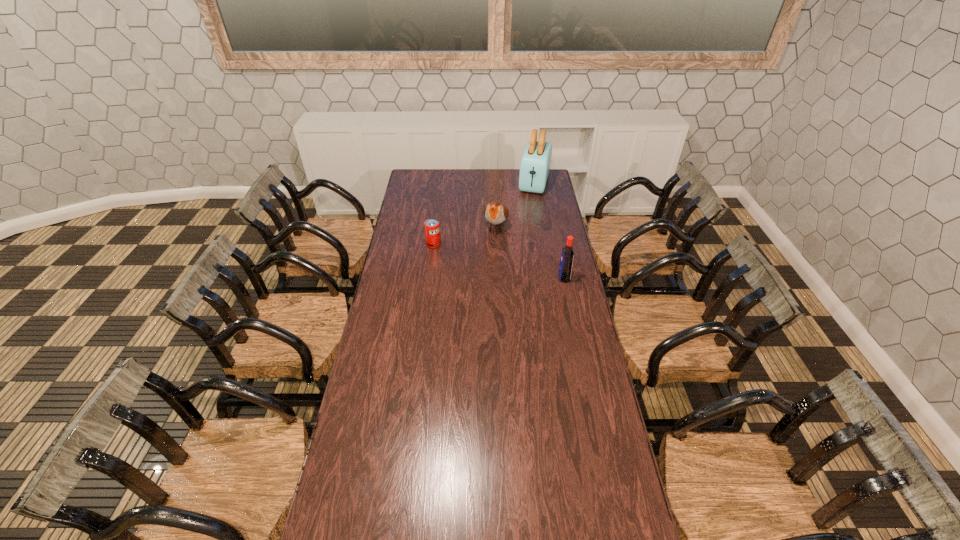
At what (x,y) coordinates should I click in order to perform the action: click on can. Please return your answer as a coordinate pair (x, y). Looking at the image, I should click on (432, 229).

This screenshot has height=540, width=960. Identify the location of the leftmost object. (432, 229).

Find the location of a particular element. Image resolution: width=960 pixels, height=540 pixels. vodka is located at coordinates (565, 267).

I want to click on the third shortest object, so click(x=565, y=267).

The image size is (960, 540). I want to click on bird, so click(x=496, y=213).

You are a GUI agent. You are given a task and a screenshot of the screen. Output one action in this format:
    pyautogui.click(x=<x>, y=<y>)
    Task: Click on the third tallest object
    
    Given the screenshot: What is the action you would take?
    pyautogui.click(x=496, y=213)

Where is `the farthest object`? This screenshot has width=960, height=540. the farthest object is located at coordinates (535, 164).

Where is `the tallest object`? The height and width of the screenshot is (540, 960). the tallest object is located at coordinates (535, 164).

Find the location of a particular element. free region located 0.120m on the front of the leftmost object is located at coordinates (431, 265).

This screenshot has width=960, height=540. What are the coordinates of `vacant point located at the face of the second farthest object` in the screenshot? It's located at (482, 272).